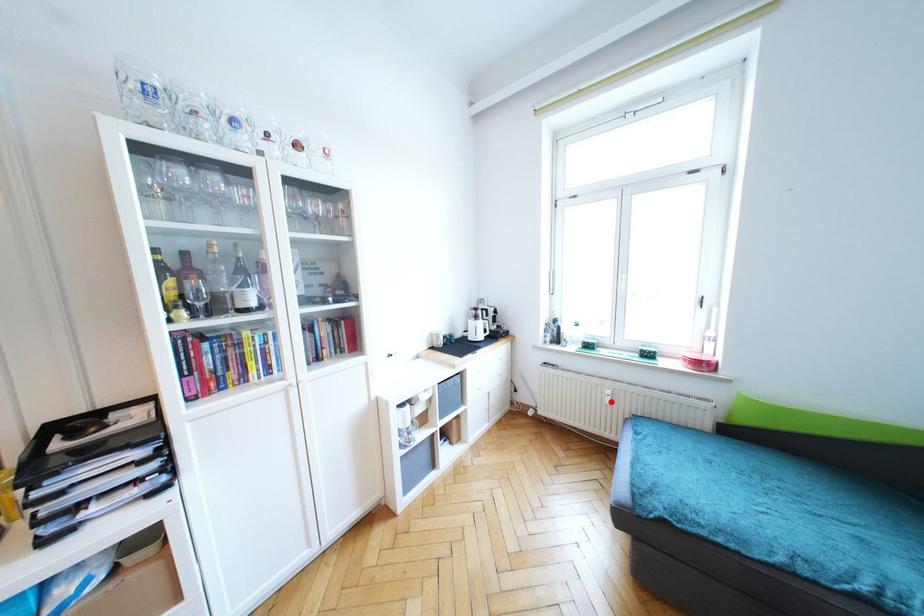
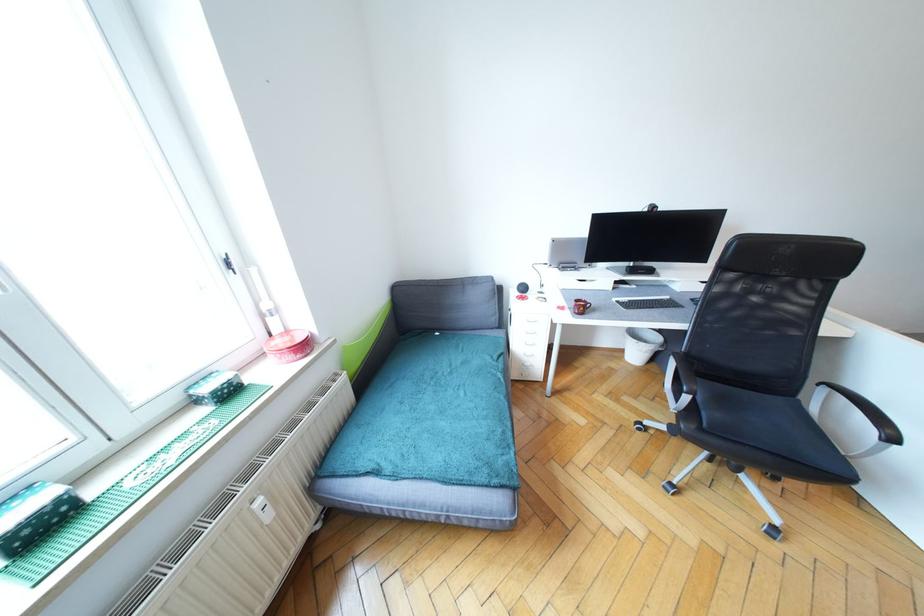
Where in the second image is the point corresponding to the highlighted location from the first image?

(272, 517)